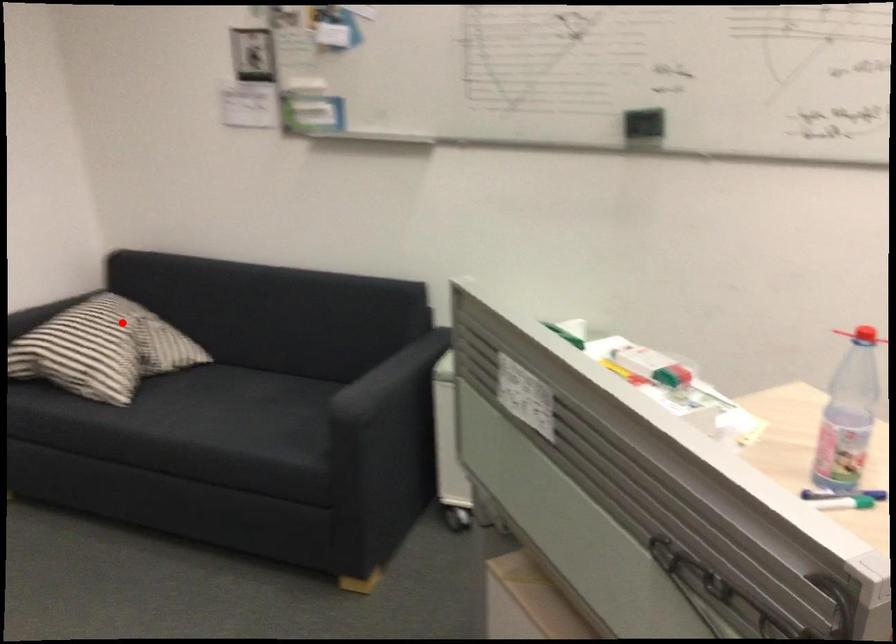
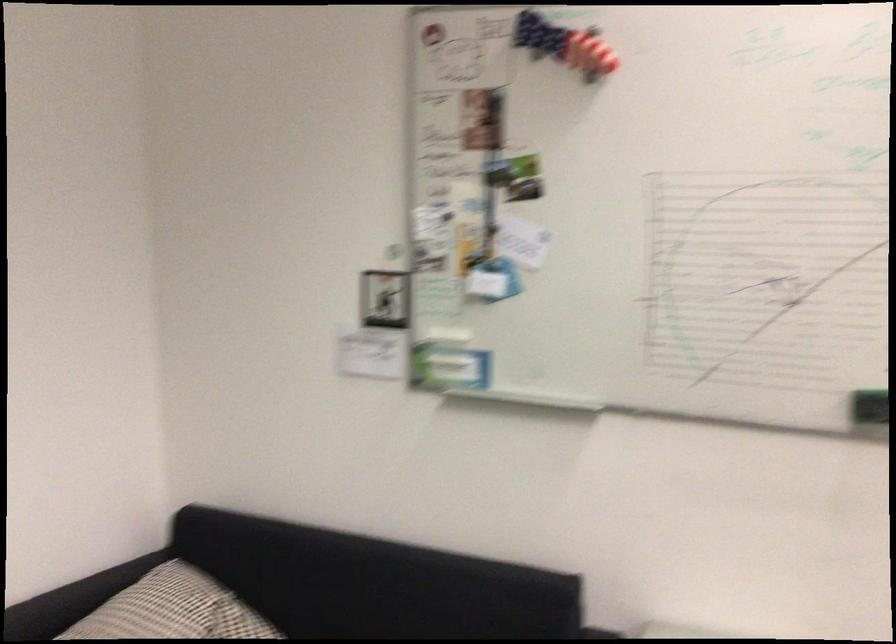
Question: A red point is marked in image1. In image2, is the corresponding 3D point closer to the camera or farther? Reply with the corresponding letter.

Choices:
 (A) The corresponding 3D point is closer.
 (B) The corresponding 3D point is farther.

Answer: (A)